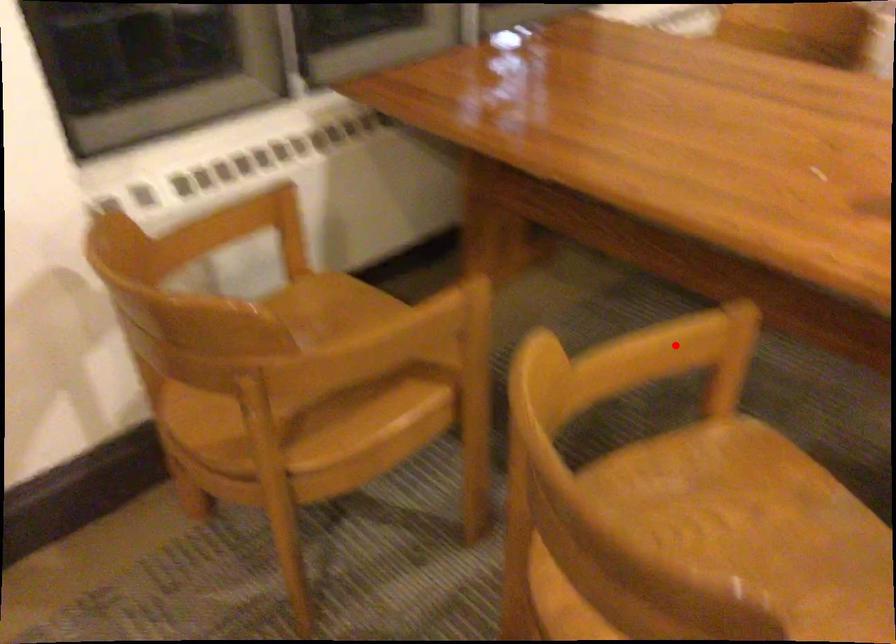
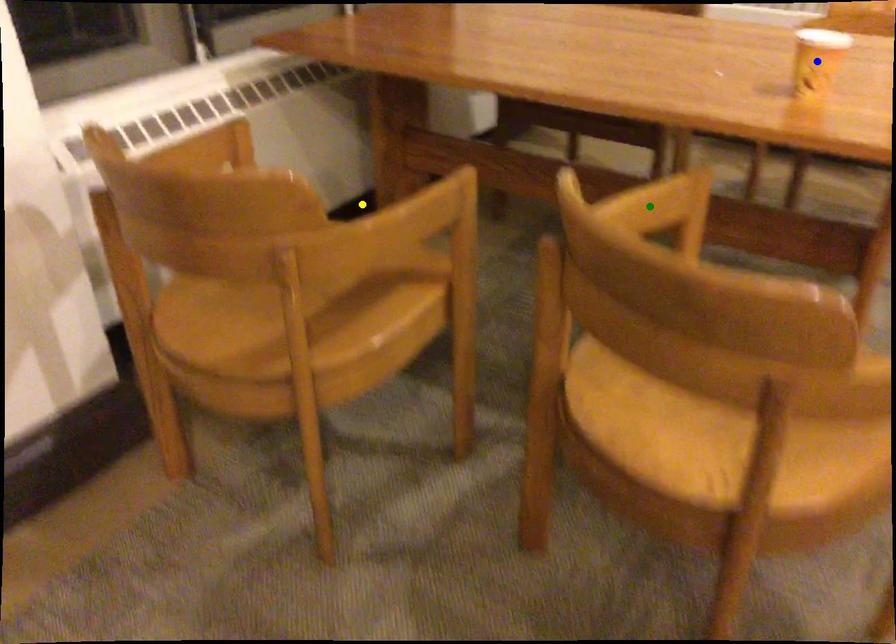
Question: I am providing you with two images of the same scene from different viewpoints. A red point is marked on the first image. You are given multiple points on the second image. Can you choose the point in image 2 that corresponds to the point in image 1?

Choices:
 (A) blue point
 (B) green point
 (C) yellow point

Answer: (B)